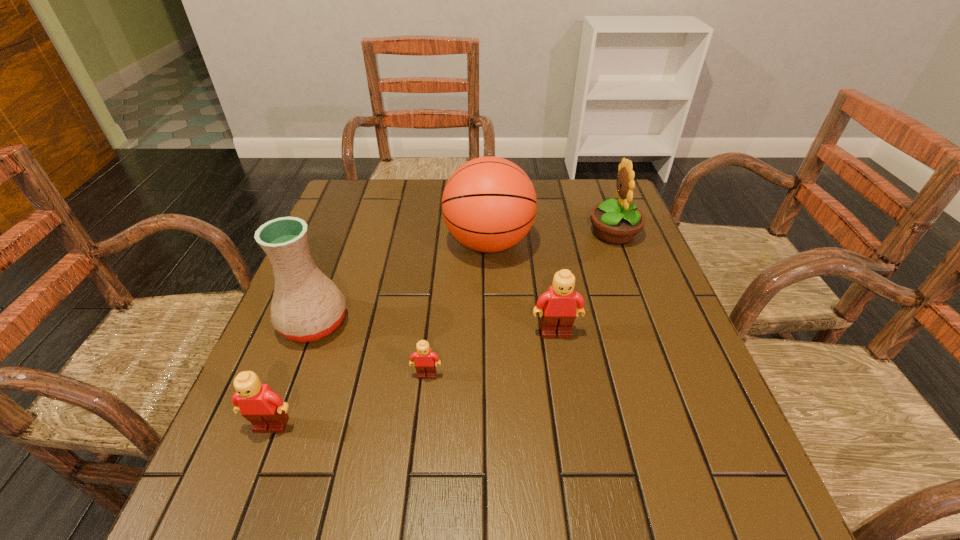
Where is `free spot between the basketball and the second shortest object`? free spot between the basketball and the second shortest object is located at coordinates (380, 334).

Find the location of `vacant space that's between the second shortest Lego and the second nearest object`. vacant space that's between the second shortest Lego and the second nearest object is located at coordinates (348, 400).

Image resolution: width=960 pixels, height=540 pixels. I want to click on free space between the second farthest Lego and the basketball, so click(458, 309).

This screenshot has width=960, height=540. What are the coordinates of `free point between the rightmost Lego and the pottery` in the screenshot? It's located at (435, 328).

This screenshot has width=960, height=540. I want to click on free space between the second shortest object and the shortest object, so click(348, 400).

Identify the location of free space between the second nearest Lego and the basketball. (458, 309).

Locate an element on the screen. The width and height of the screenshot is (960, 540). free spot between the rightmost object and the basketball is located at coordinates (551, 238).

At what (x,y) coordinates should I click in order to perform the action: click on free spot between the pottery and the second shortest Lego. Please return your answer as a coordinate pair (x, y). This screenshot has height=540, width=960. Looking at the image, I should click on (293, 374).

Where is `vacant space that is in between the fifth tallest object and the basketball`? The image size is (960, 540). vacant space that is in between the fifth tallest object and the basketball is located at coordinates (380, 334).

Identify which object is located as the second nearest to the basketball. Please provide its 2D coordinates. Your answer should be formatted as a tuple, i.e. [(x, y)], where the tuple contains the x and y coordinates of a point satisfying the conditions above.

[(559, 311)]